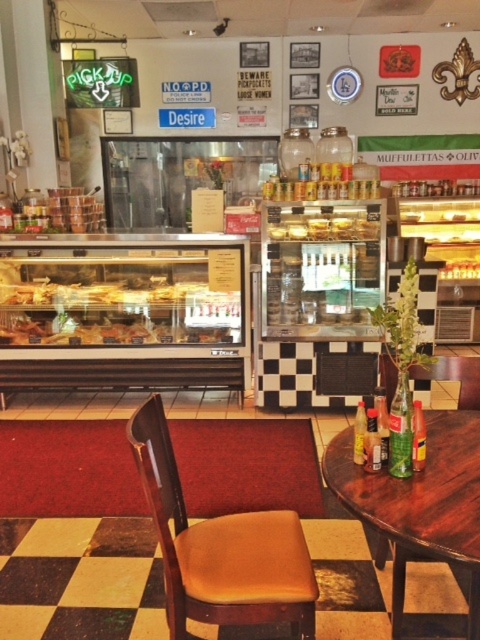
Question: Does brown leather chair at center appear on the right side of translucent glass pastries at center?

Choices:
 (A) yes
 (B) no

Answer: (A)

Question: Does brown leather chair at center have a smaller size compared to wooden table at right?

Choices:
 (A) yes
 (B) no

Answer: (B)

Question: Estimate the real-world distances between objects in this image. Which object is closer to the translucent glass pastries at center?

Choices:
 (A) wooden table at right
 (B) brown leather chair at center

Answer: (B)

Question: Which point appears farthest from the camera in this image?

Choices:
 (A) (472, 538)
 (B) (132, 280)
 (C) (248, 524)

Answer: (B)

Question: Which point is farther from the camera taking this photo?

Choices:
 (A) (180, 333)
 (B) (352, 509)
 (C) (267, 596)

Answer: (A)

Question: Is wooden table at right bigger than translucent glass pastries at center?

Choices:
 (A) no
 (B) yes

Answer: (A)